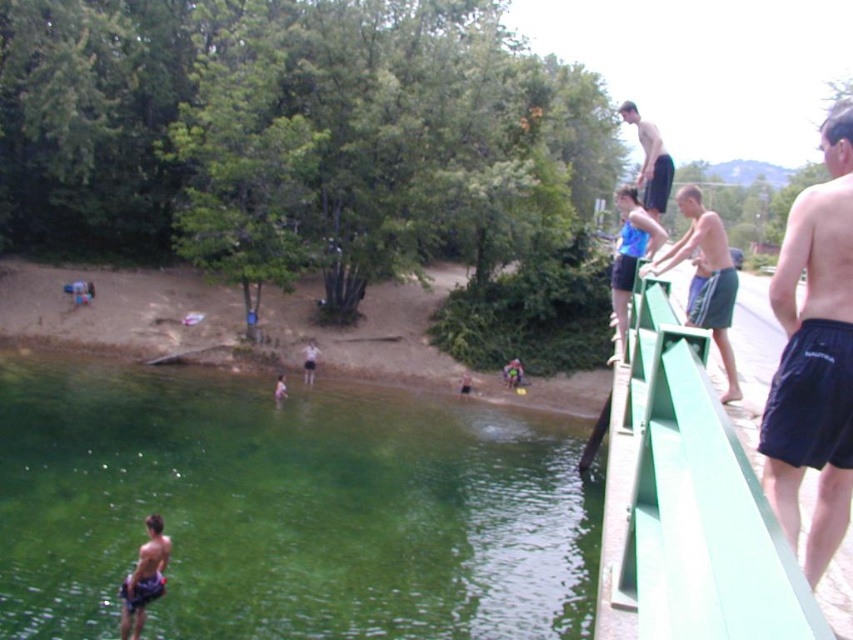
You are a photographer positioned at the edge of the water body. You want to capture a photo that includes both the green translucent water at lower left and the black fabric shorts at right. Which object should you adjust your camera angle to prioritize to ensure both are in the frame?

Since the black fabric shorts at right is behind the green translucent water at lower left, you can adjust your camera angle to focus slightly forward to include the green translucent water at lower left while still capturing the black fabric shorts at right in the background.

You are a swimmer who wants to jump into the water from the diving board. You notice the green translucent water at lower left and the blue fabric shorts at upper right. Which object is lower in height?

The green translucent water at lower left has a lesser height compared to the blue fabric shorts at upper right, so the green translucent water at lower left is lower in height.